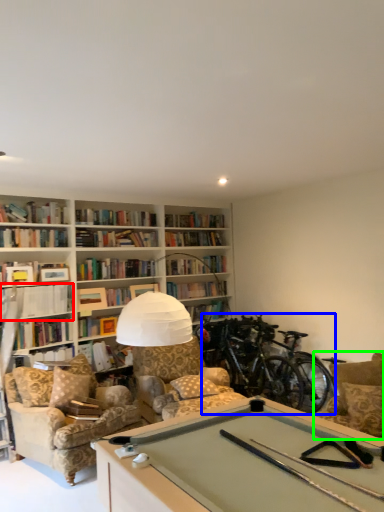
Question: Which object is positioned closest to book (highlighted by a red box)? Select from bicycle (highlighted by a blue box) and armchair (highlighted by a green box).

Choices:
 (A) bicycle
 (B) armchair

Answer: (A)